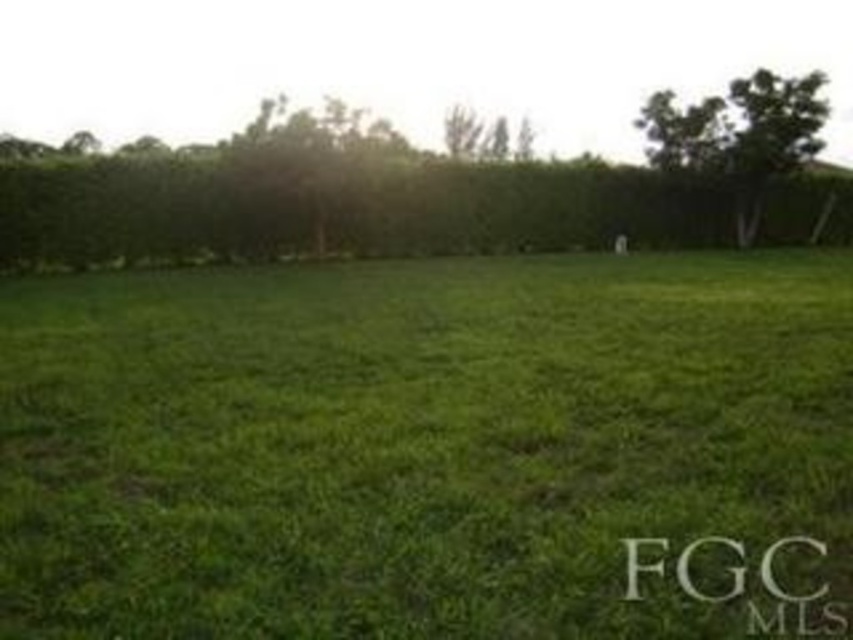
Does green grass at center have a greater height compared to green leafy hedge at upper center?

Incorrect, green grass at center's height is not larger of green leafy hedge at upper center's.

Can you confirm if green grass at center is bigger than green leafy hedge at upper center?

Incorrect, green grass at center is not larger than green leafy hedge at upper center.

Describe the element at coordinates (426, 445) in the screenshot. The height and width of the screenshot is (640, 853). I see `green grass at center` at that location.

Find the location of a particular element. Image resolution: width=853 pixels, height=640 pixels. green grass at center is located at coordinates (426, 445).